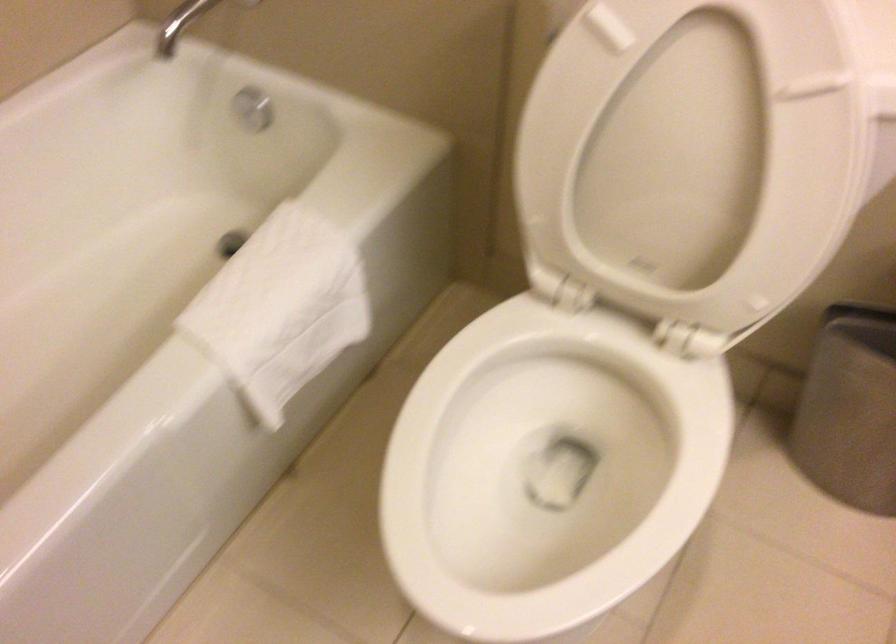
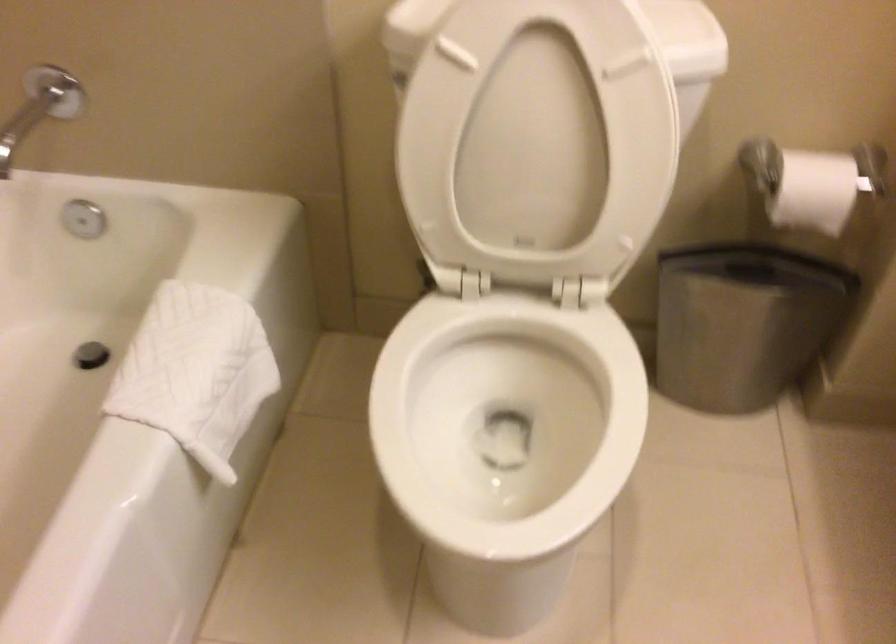
Which direction would the cameraman need to move to produce the second image?

The movement direction of the cameraman is left, backward.